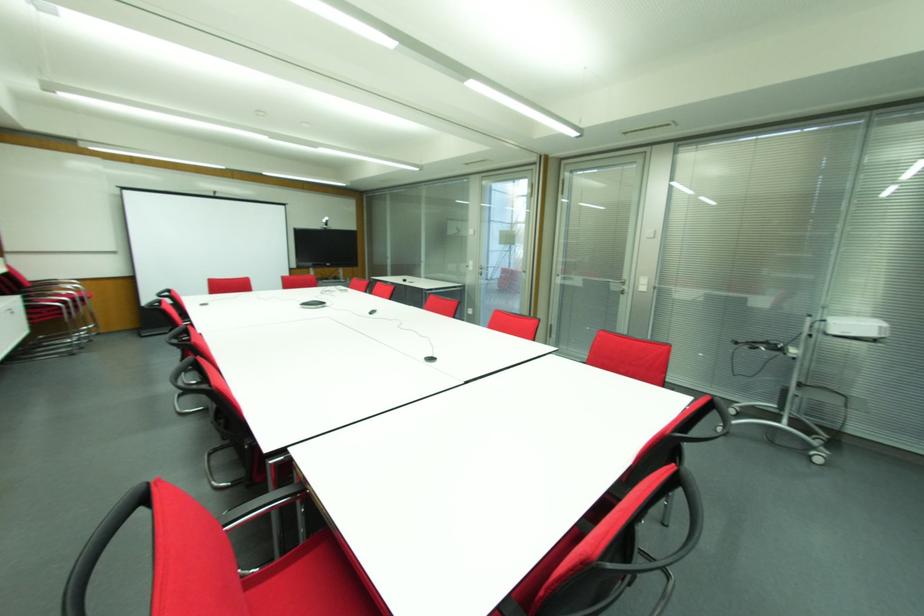
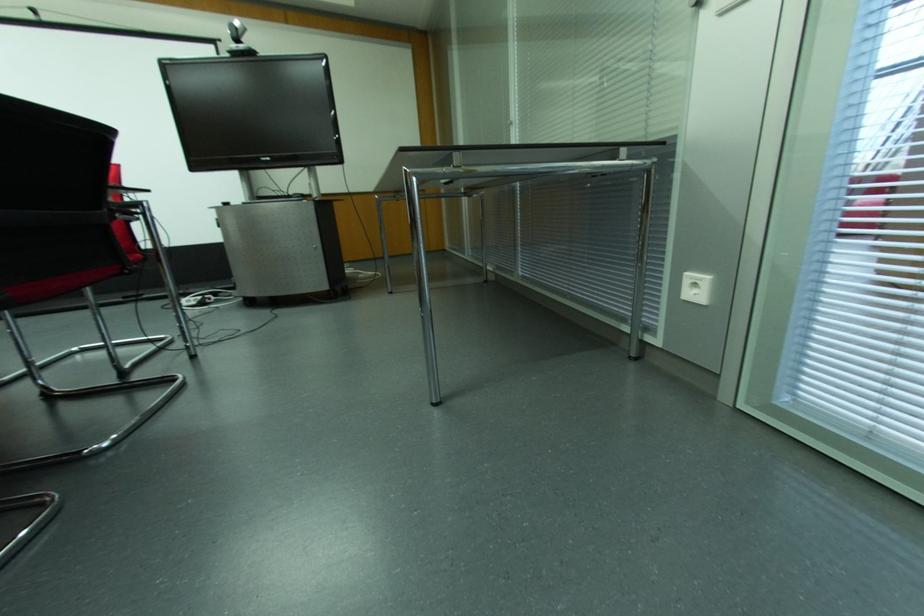
Locate, in the second image, the point that corresponds to the point at 325,217 in the first image.

(237, 23)